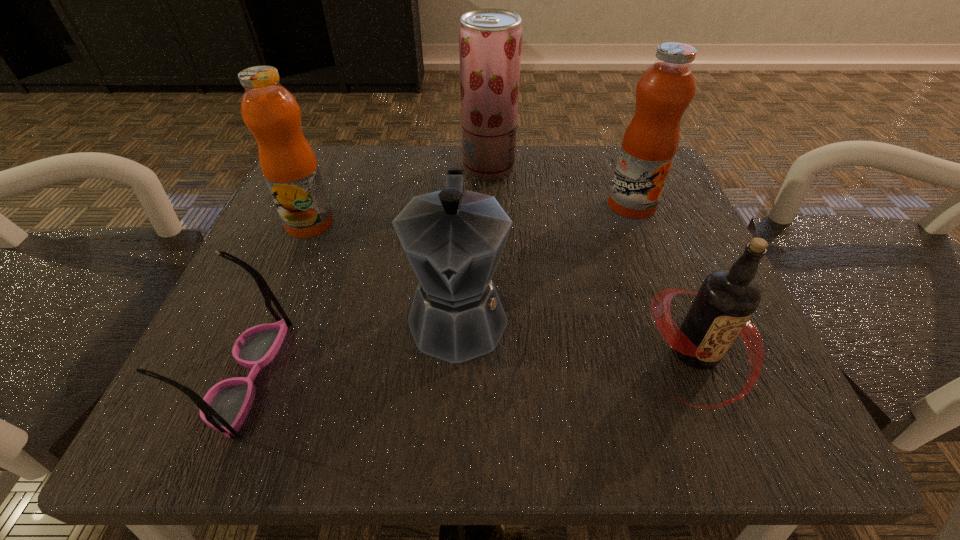
Where is `object that is at the near left corner`? object that is at the near left corner is located at coordinates (224, 408).

The height and width of the screenshot is (540, 960). I want to click on object located at the far right corner, so click(x=664, y=91).

Find the location of a particular element. object that is at the near right corner is located at coordinates (726, 300).

Find the location of a particular element. The height and width of the screenshot is (540, 960). vacant region at the far edge of the desktop is located at coordinates (500, 194).

Where is `free location at the near edge of the desktop`? The image size is (960, 540). free location at the near edge of the desktop is located at coordinates (516, 381).

Locate an element on the screen. The width and height of the screenshot is (960, 540). free space at the left edge of the desktop is located at coordinates click(x=349, y=256).

The height and width of the screenshot is (540, 960). In order to click on vacant space at the right edge in this screenshot , I will do `click(656, 241)`.

Where is `vacant area at the far left corner of the desktop`? vacant area at the far left corner of the desktop is located at coordinates (372, 162).

Where is `vacant space at the far right corner of the desktop`? vacant space at the far right corner of the desktop is located at coordinates (617, 149).

Locate an element on the screen. This screenshot has width=960, height=540. free space at the near right corner of the desktop is located at coordinates click(731, 409).